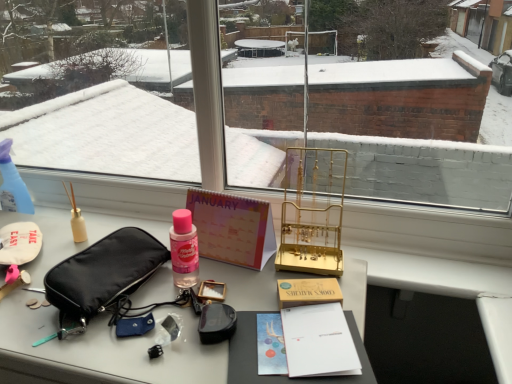
Find the location of a particular element. The image size is (512, 384). vacant space that is to the left of gold metallic jewelry stand at center is located at coordinates (237, 277).